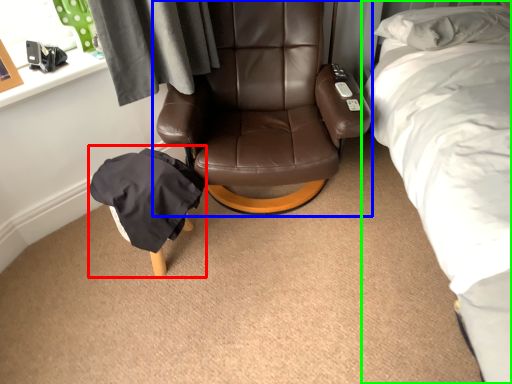
Question: Which object is positioned farthest from bean bag chair (highlighted by a red box)? Select from chair (highlighted by a blue box) and bed (highlighted by a green box).

Choices:
 (A) chair
 (B) bed

Answer: (B)